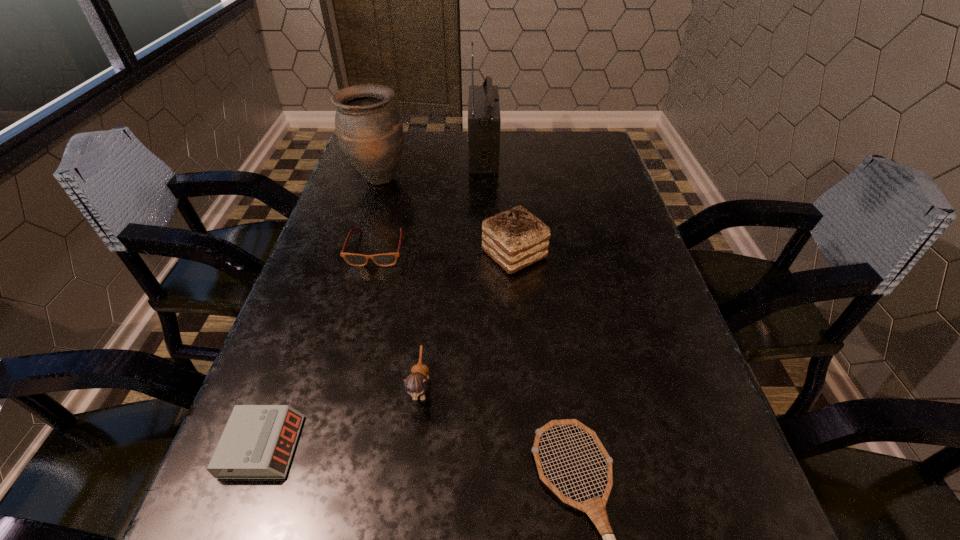
The width and height of the screenshot is (960, 540). I want to click on radio receiver, so [484, 120].

Image resolution: width=960 pixels, height=540 pixels. I want to click on the second tallest object, so click(x=369, y=129).

Where is `chocolate cake`? The height and width of the screenshot is (540, 960). chocolate cake is located at coordinates (514, 239).

Locate an element on the screen. the third nearest object is located at coordinates (417, 383).

Locate an element on the screen. The width and height of the screenshot is (960, 540). the fourth shortest object is located at coordinates (417, 383).

Image resolution: width=960 pixels, height=540 pixels. In order to click on spectacles in this screenshot , I will do `click(387, 259)`.

Find the location of `alarm clock`. alarm clock is located at coordinates (258, 441).

What are the coordinates of `free location located on the front panel of the tallest object` in the screenshot? It's located at (428, 154).

The width and height of the screenshot is (960, 540). Identify the location of vacant area located 0.110m on the front panel of the tallest object. (432, 154).

The height and width of the screenshot is (540, 960). I want to click on vacant space located on the front panel of the tallest object, so click(402, 154).